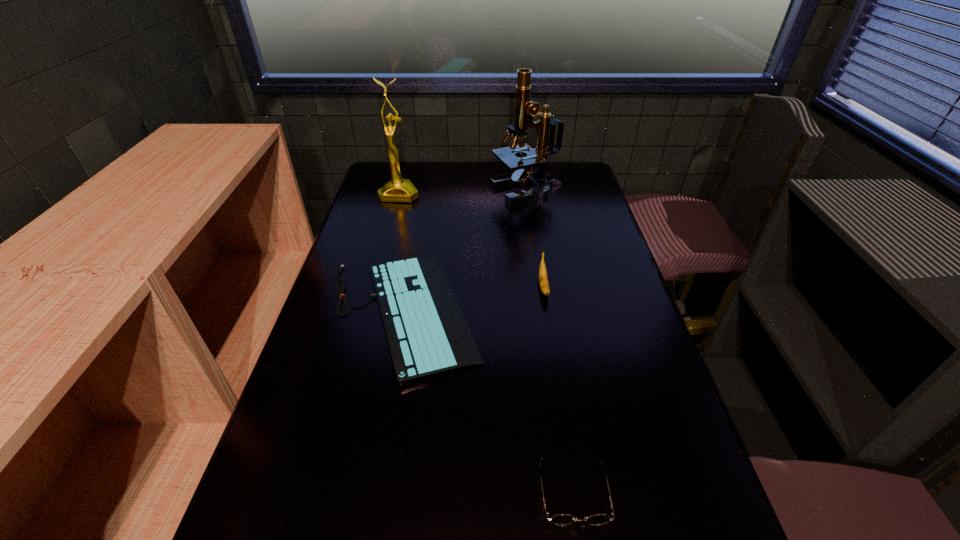
Where is `blank space located 0.090m on the peel of the third shortest object from the top`? Image resolution: width=960 pixels, height=540 pixels. blank space located 0.090m on the peel of the third shortest object from the top is located at coordinates (550, 329).

The height and width of the screenshot is (540, 960). I want to click on vacant space located 0.120m on the right of the computer keyboard, so click(531, 313).

This screenshot has width=960, height=540. In order to click on microscope present at the far edge in this screenshot , I will do point(525,109).

You are a GUI agent. You are given a task and a screenshot of the screen. Output one action in this format:
    pyautogui.click(x=<x>, y=<y>)
    Task: Click on the award at the far edge
    The image size is (960, 540).
    Given the screenshot: What is the action you would take?
    pyautogui.click(x=398, y=189)

Where is `award present at the left edge`? This screenshot has width=960, height=540. award present at the left edge is located at coordinates (398, 189).

The image size is (960, 540). I want to click on computer keyboard that is at the left edge, so click(427, 335).

Find the location of a particular element. This screenshot has width=960, height=540. object that is at the right edge is located at coordinates (525, 109).

I want to click on object located at the far left corner, so click(x=398, y=189).

Find the location of a particular element. This screenshot has height=540, width=960. object at the far right corner is located at coordinates click(x=525, y=109).

Identify the location of vacant space at the left edge of the desktop. pyautogui.click(x=326, y=450).